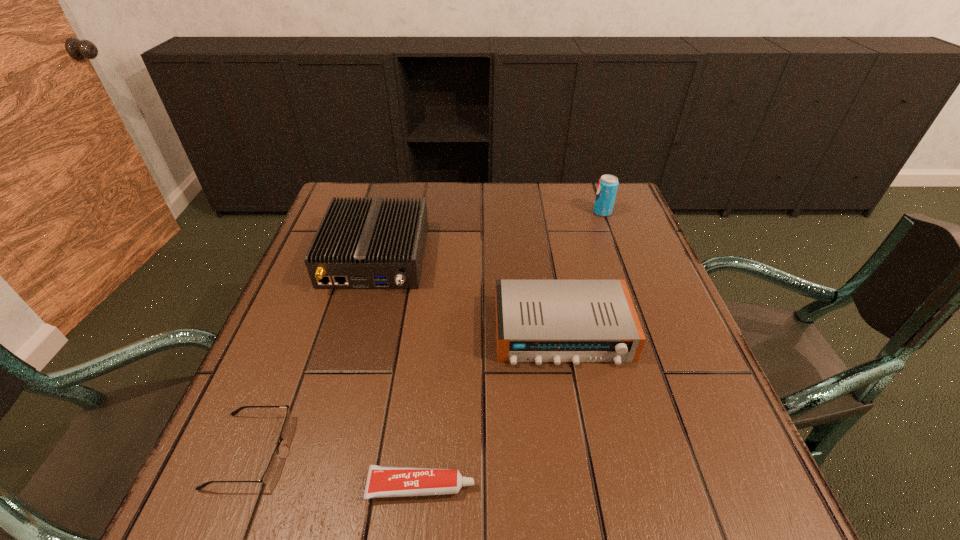
I want to click on soda can, so click(x=607, y=188).

Identify the location of the rightmost object. (607, 188).

Identify the location of the second farthest object. (360, 244).

The width and height of the screenshot is (960, 540). I want to click on the third tallest object, so click(x=557, y=321).

Identify the location of the second object from right to left. (557, 321).

Identify the location of spectacles. (273, 464).

Image resolution: width=960 pixels, height=540 pixels. Identify the location of toothpaste. (382, 481).

Where is `free space located 0.400m on the left of the soda can`? The height and width of the screenshot is (540, 960). free space located 0.400m on the left of the soda can is located at coordinates (455, 212).

Identify the location of vacant space located 0.130m on the back panel of the fourth nearest object. (352, 339).

Image resolution: width=960 pixels, height=540 pixels. In order to click on free space located on the control panel of the second object from right to left in this screenshot , I will do `click(583, 445)`.